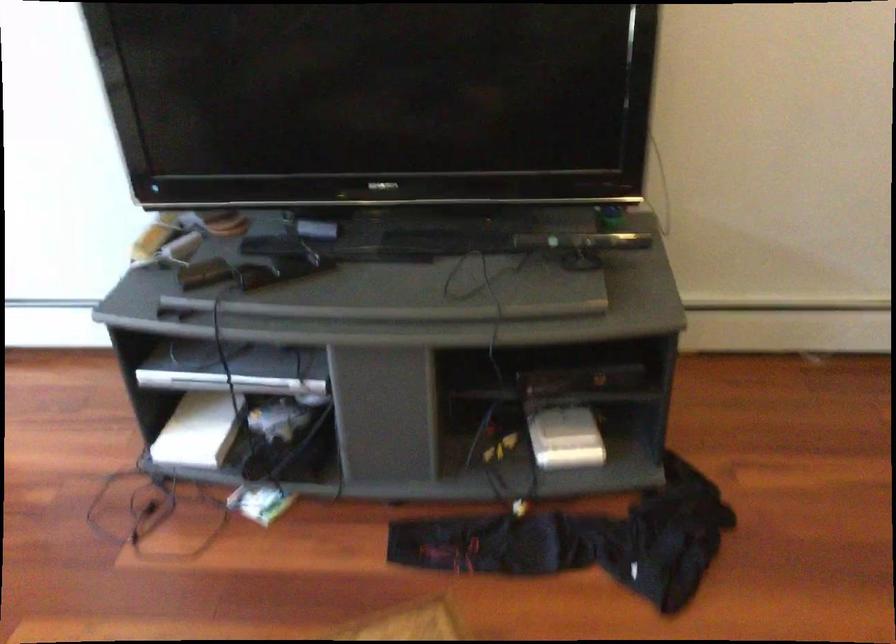
Find the location of a particular element. black sensor bar is located at coordinates (582, 241).